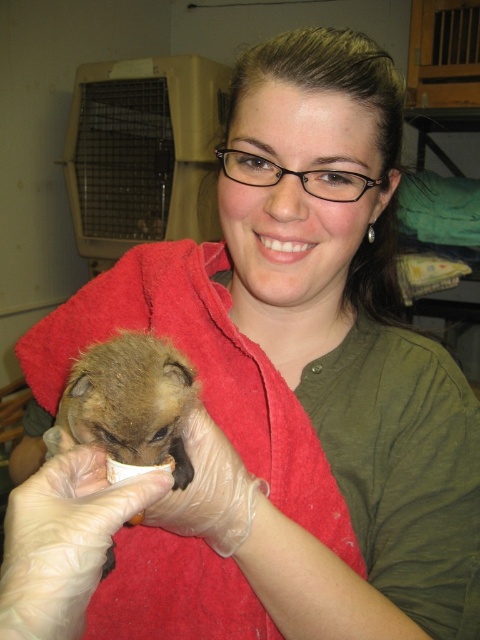
You are a veterinarian who needs to check the health of the brown fuzzy bat at center. Given that your stethoscope can only reach up to 16 inches, can you effectively use it without moving the bat?

The brown fuzzy bat at center and viewer are 17.86 inches apart from each other, which is beyond the stethoscope range of 16 inches. Therefore, you cannot effectively use it without moving the bat closer.

You are a veterinarian preparing to examine an animal. You see the brown fuzzy bat at center and the transparent plastic glove at center. Which object is wider?

The brown fuzzy bat at center is wider than the transparent plastic glove at center.

You are a veterinary assistant trying to locate two specific points marked in the clinic. The first point is at coordinate point (20, 506) and the second is at point (137, 397). From your current position, which point is closer to you?

Point (20, 506) is in front of point (137, 397), so the first point is closer to you.